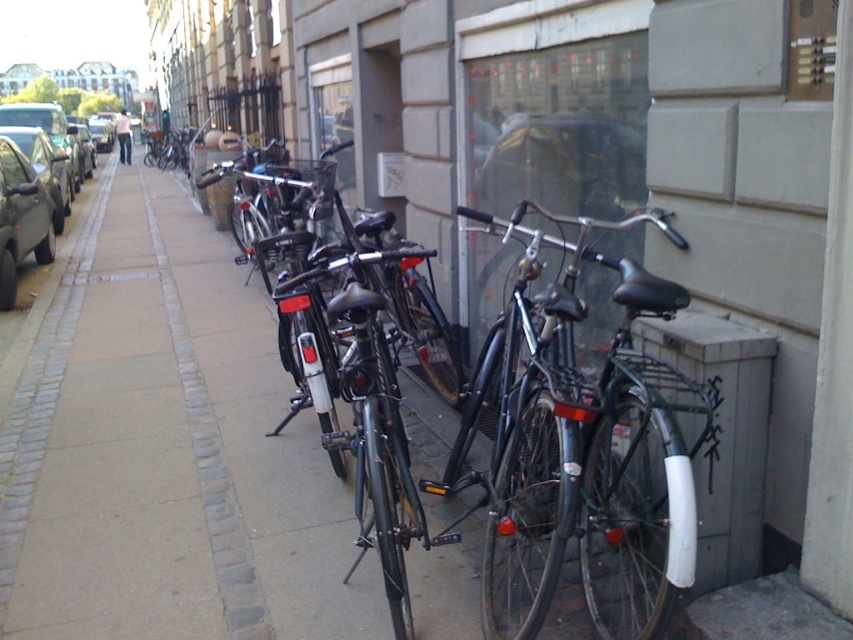
Question: Considering the relative positions of shiny black bicycle at center and matte black car at left in the image provided, where is shiny black bicycle at center located with respect to matte black car at left?

Choices:
 (A) left
 (B) right

Answer: (B)

Question: Is shiny silver car at left positioned behind matte black car at left?

Choices:
 (A) yes
 (B) no

Answer: (A)

Question: Is shiny silver car at left wider than matte black car at left?

Choices:
 (A) no
 (B) yes

Answer: (B)

Question: Which point is closer to the camera?

Choices:
 (A) matte black car at left
 (B) shiny silver car at left
 (C) shiny black bicycle at center

Answer: (C)

Question: Which point appears farthest from the camera in this image?

Choices:
 (A) (65, 122)
 (B) (523, 598)

Answer: (A)

Question: Among these objects, which one is farthest from the camera?

Choices:
 (A) matte black car at left
 (B) shiny silver car at left
 (C) shiny black bicycle at center

Answer: (B)